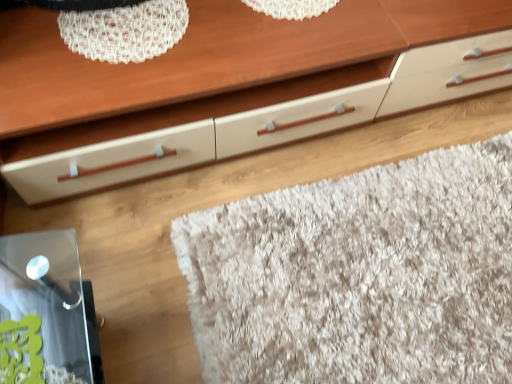
Image resolution: width=512 pixels, height=384 pixels. What do you see at coordinates (230, 85) in the screenshot? I see `white wood chest of drawers at center` at bounding box center [230, 85].

Find the location of `white wood chest of drawers at center`. white wood chest of drawers at center is located at coordinates (230, 85).

This screenshot has width=512, height=384. I want to click on white wood chest of drawers at center, so click(x=230, y=85).